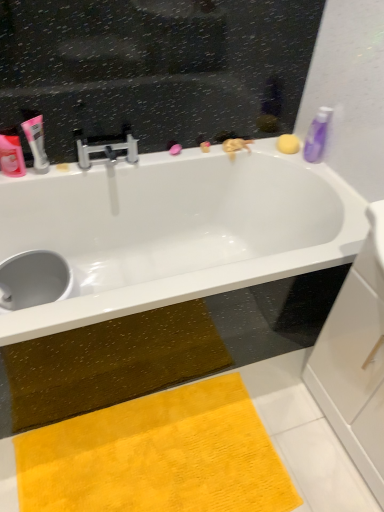
Find the location of `vacant space situated on the left part of purple glossy bottle at upper right, the third toiletry viewed from the left`. vacant space situated on the left part of purple glossy bottle at upper right, the third toiletry viewed from the left is located at coordinates (286, 155).